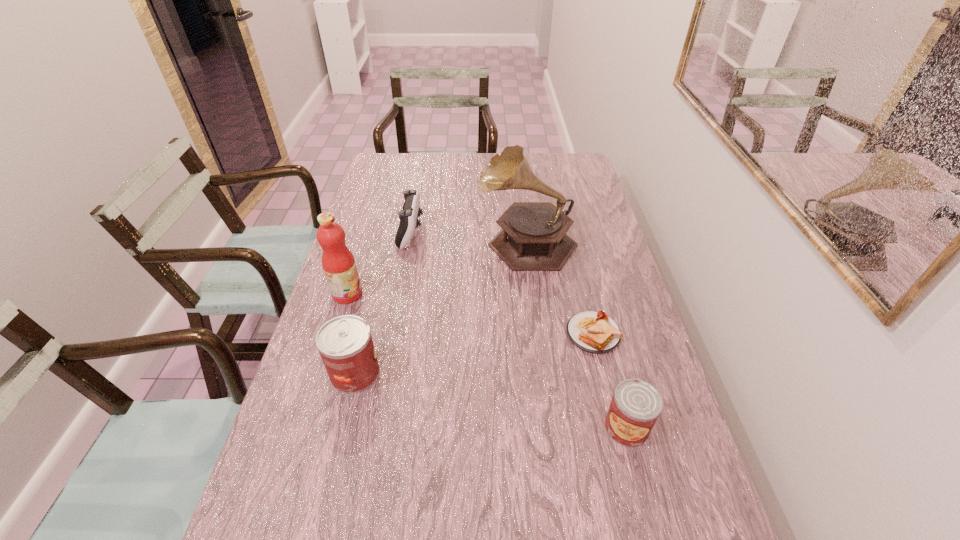
Where is `vacant space located 0.150m on the horn direction of the phonograph record`? vacant space located 0.150m on the horn direction of the phonograph record is located at coordinates (433, 241).

Locate an element on the screen. blank area located 0.110m on the horn direction of the phonograph record is located at coordinates (444, 241).

The width and height of the screenshot is (960, 540). What are the coordinates of `vacant region located on the horn direction of the phonograph record` in the screenshot? It's located at (442, 241).

You are a GUI agent. You are given a task and a screenshot of the screen. Output one action in this format:
    pyautogui.click(x=<x>, y=<y>)
    Task: Click on the free space located on the front-facing side of the control
    The width and height of the screenshot is (960, 540).
    Given the screenshot: What is the action you would take?
    pyautogui.click(x=461, y=233)

You are a GUI agent. You are given a task and a screenshot of the screen. Output one action in this format:
    pyautogui.click(x=<x>, y=<y>)
    Task: Click on the vacant area situated 0.400m on the front label of the fourth nearest object
    This screenshot has width=960, height=540.
    Given the screenshot: What is the action you would take?
    pyautogui.click(x=496, y=294)

Where is `vacant space positioned 0.390m on the front of the sandwich`? Image resolution: width=960 pixels, height=540 pixels. vacant space positioned 0.390m on the front of the sandwich is located at coordinates pos(637,517).

Identify the location of can located in the left edge section of the desktop. coord(345,344).

What are the coordinates of `fruit juice situated at the left edge` in the screenshot? It's located at (338, 263).

The height and width of the screenshot is (540, 960). In order to click on can situated at the right edge in this screenshot , I will do `click(636, 405)`.

Identify the location of phonograph record located at the right edge. Image resolution: width=960 pixels, height=540 pixels. 533,237.